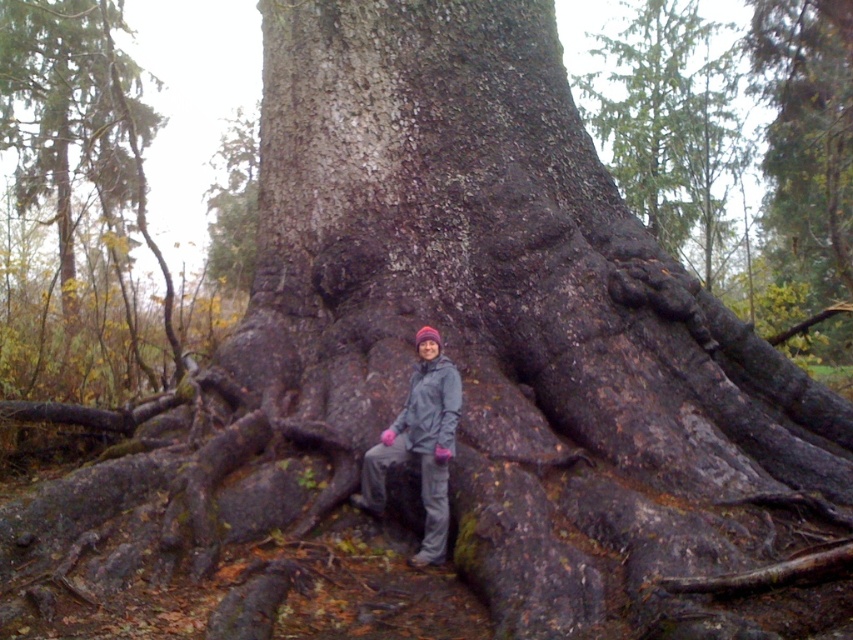
Question: Which point is closer to the camera?

Choices:
 (A) dark brown bark at upper center
 (B) dark brown bark at center
 (C) gray fabric jacket at center

Answer: (C)

Question: Does dark brown bark at center appear on the right side of dark brown bark at upper center?

Choices:
 (A) no
 (B) yes

Answer: (A)

Question: Which of the following is the farthest from the observer?

Choices:
 (A) dark brown bark at upper center
 (B) dark brown bark at center

Answer: (A)

Question: Which point is farther to the camera?

Choices:
 (A) (432, 380)
 (B) (85, 173)

Answer: (B)

Question: Can you confirm if dark brown bark at center is positioned above gray fabric jacket at center?

Choices:
 (A) no
 (B) yes

Answer: (B)

Question: Is dark brown bark at center smaller than dark brown bark at upper center?

Choices:
 (A) yes
 (B) no

Answer: (A)